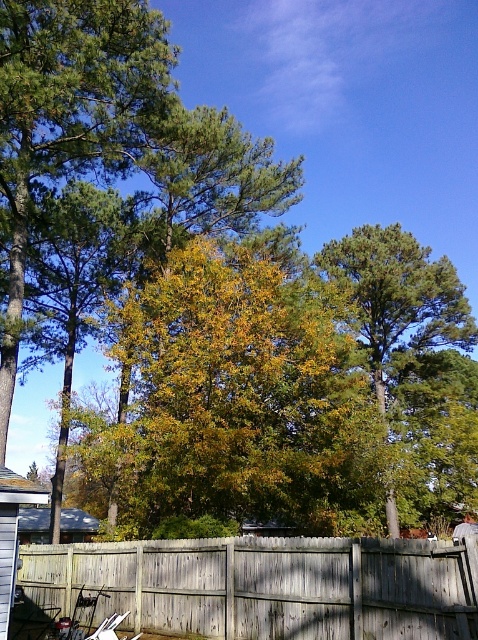
Question: Where is weathered wood fence at center located in relation to green leafy tree at center in the image?

Choices:
 (A) right
 (B) left

Answer: (B)

Question: Is weathered wood fence at center smaller than green leafy tree at center?

Choices:
 (A) yes
 (B) no

Answer: (A)

Question: Can you confirm if weathered wood fence at center is smaller than green leafy tree at center?

Choices:
 (A) yes
 (B) no

Answer: (A)

Question: Which of the following is the closest to the observer?

Choices:
 (A) (217, 570)
 (B) (373, 273)

Answer: (A)

Question: Among these points, which one is farthest from the camera?

Choices:
 (A) (412, 321)
 (B) (178, 608)

Answer: (A)